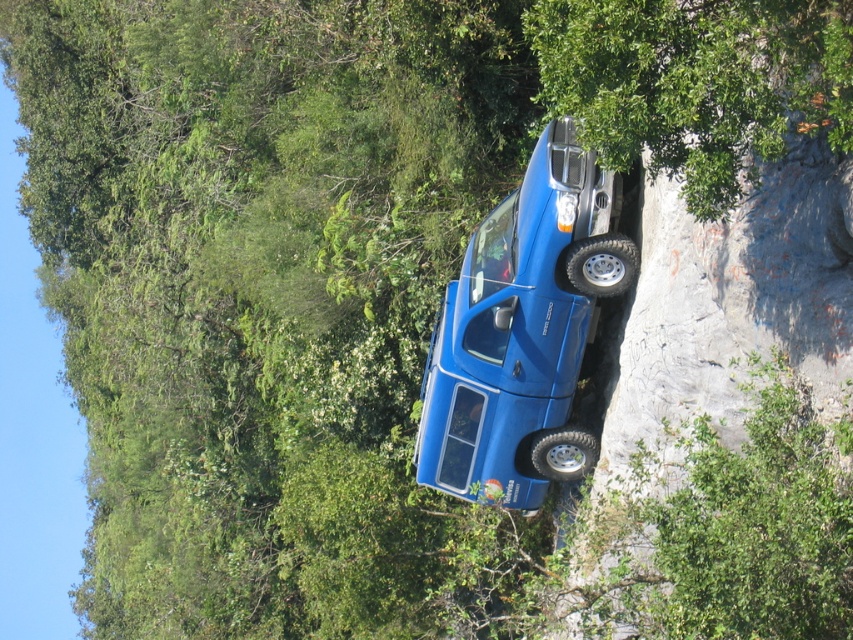
Which is above, matte blue jeep at center or green leafy tree at upper right?

Positioned higher is green leafy tree at upper right.

Can you confirm if matte blue jeep at center is positioned below green leafy tree at upper right?

Yes, matte blue jeep at center is below green leafy tree at upper right.

Is point (496, 266) positioned behind point (810, 20)?

That is True.

Image resolution: width=853 pixels, height=640 pixels. I want to click on matte blue jeep at center, so click(523, 332).